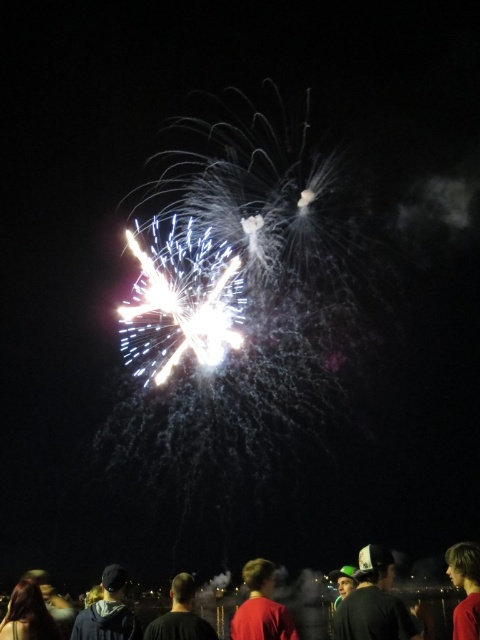
You are standing in the crowd watching the fireworks and want to move from your current position to the fireworks display. Which point, point 1 at coordinates [382,556] or point 2 at coordinates [103,637], is closer to you?

Point 1 at coordinates [382,556] is closer to you because it is further to the viewer than point 2 at coordinates [103,637].

You are a photographer trying to capture a photo of the fireworks display. You notice the green cap at lower right and the dark blue hoodie at lower left in your frame. Which object should you adjust your focus to ensure the subject with the greater height is in the foreground? Please mention both objects in your answer.

The dark blue hoodie at lower left has a greater height compared to the green cap at lower right. To ensure the subject with the greater height is in the foreground, adjust your focus towards the dark blue hoodie at lower left.